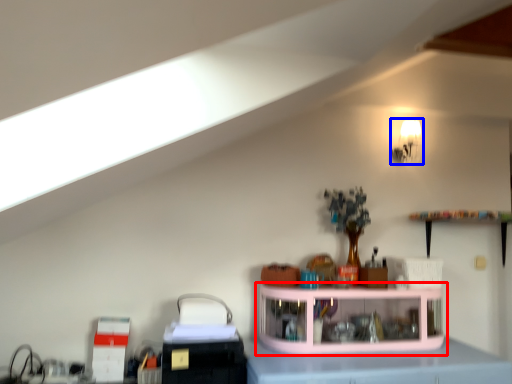
Question: Which of the following is the farthest to the observer, shelf (highlighted by a red box) or light fixture (highlighted by a blue box)?

Choices:
 (A) shelf
 (B) light fixture

Answer: (B)